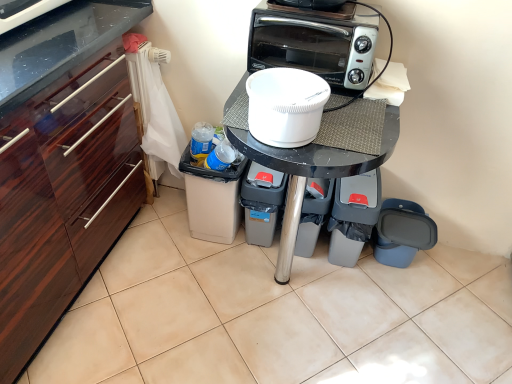
Identify the location of vacant area that is situated to the right of black glossy table at center. (420, 311).